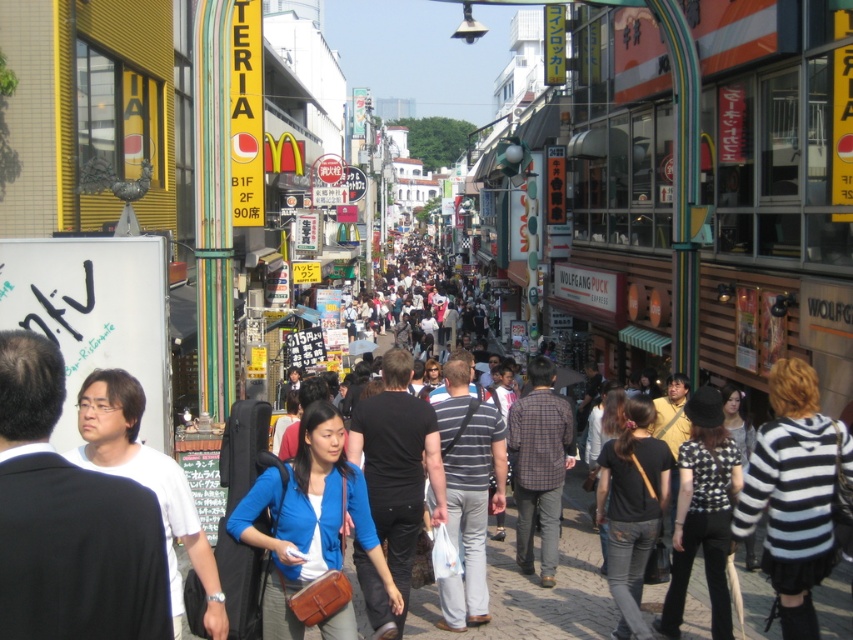
Question: Which point is closer to the camera taking this photo?

Choices:
 (A) (120, 419)
 (B) (154, 616)
 (C) (790, 419)
 (D) (332, 422)

Answer: (B)

Question: Can you confirm if blue fabric jacket at center is positioned to the right of multicolored fabric crowd at center?

Choices:
 (A) no
 (B) yes

Answer: (B)

Question: Which point is farther to the camera?

Choices:
 (A) blue fabric jacket at center
 (B) black matte shirt at center
 (C) black and white checkered shirt at center

Answer: (C)

Question: Which object appears closest to the camera in this image?

Choices:
 (A) black matte shirt at center
 (B) black and white striped sweater at lower right
 (C) black matte jacket at left
 (D) black and white checkered shirt at center

Answer: (C)

Question: Is black matte shirt at center to the left of white matte shirt at center from the viewer's perspective?

Choices:
 (A) yes
 (B) no

Answer: (B)

Question: Is black matte shirt at center in front of multicolored fabric crowd at center?

Choices:
 (A) no
 (B) yes

Answer: (B)